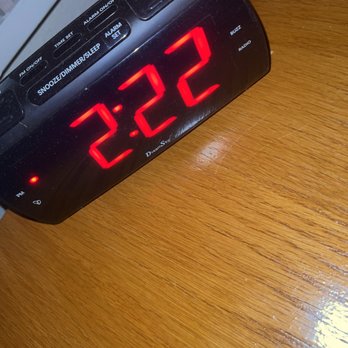
You are a GUI agent. You are given a task and a screenshot of the screen. Output one action in this format:
    pyautogui.click(x=<x>, y=<y>)
    Task: Click on the snooze button
    This screenshot has height=348, width=348.
    Given the screenshot: What is the action you would take?
    pyautogui.click(x=71, y=70)